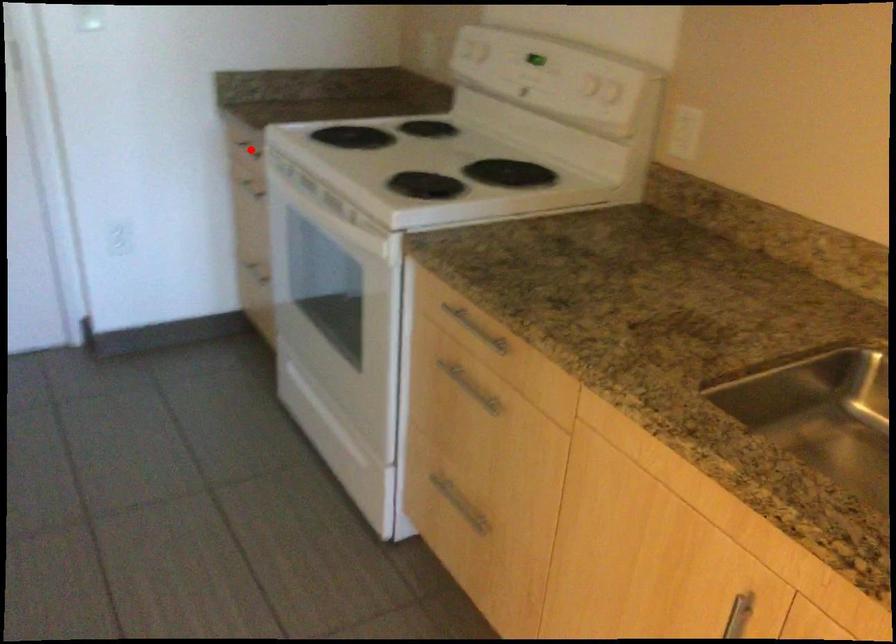
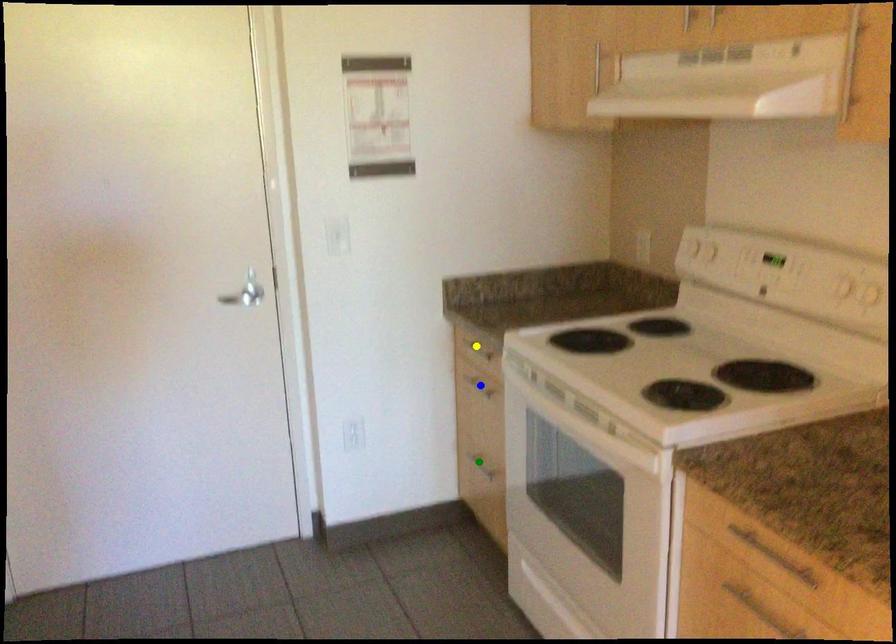
Question: I am providing you with two images of the same scene from different viewpoints. A red point is marked on the first image. You are given multiple points on the second image. In image 2, which mark is for the same physical point as the one in image 1?

Choices:
 (A) blue point
 (B) yellow point
 (C) green point

Answer: (B)